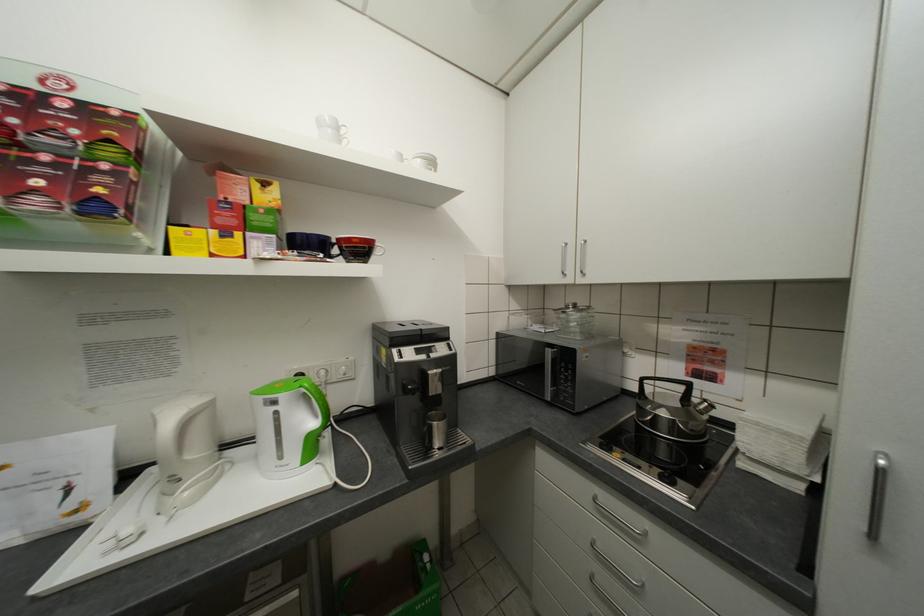
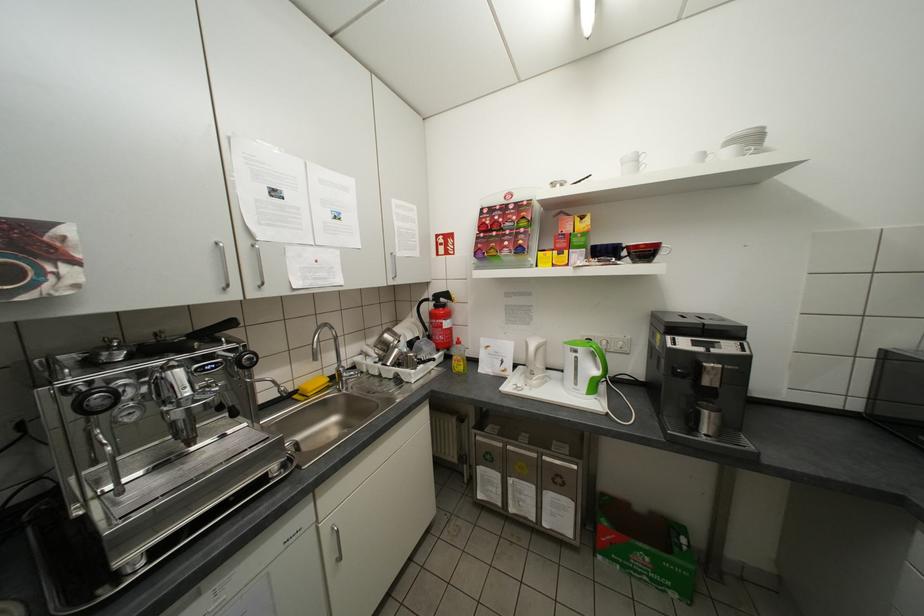
In the second image, find the point that corresponds to the point at 362,241 in the first image.

(650, 246)